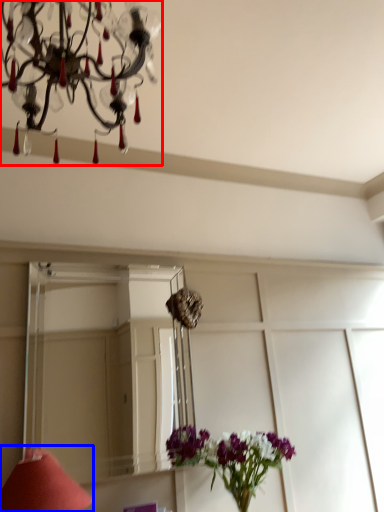
Question: Which of the following is the farthest to the observer, lamp (highlighted by a red box) or table lamp (highlighted by a blue box)?

Choices:
 (A) lamp
 (B) table lamp

Answer: (B)